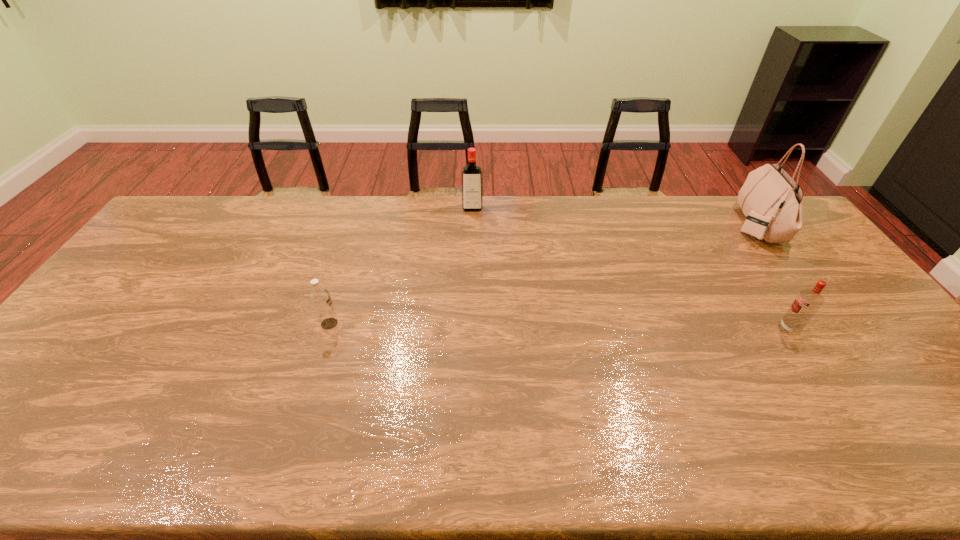
Locate an element on the screen. vacant area between the tallest object and the third object from left to right is located at coordinates (772, 276).

Where is `vacant area that lies between the second object from right to left and the rightmost object`? vacant area that lies between the second object from right to left and the rightmost object is located at coordinates (772, 276).

Where is `object that is the third closest one to the third object from left to right`? The image size is (960, 540). object that is the third closest one to the third object from left to right is located at coordinates (320, 298).

Select which object is the third closest to the handbag. Please provide its 2D coordinates. Your answer should be formatted as a tuple, i.e. [(x, y)], where the tuple contains the x and y coordinates of a point satisfying the conditions above.

[(320, 298)]

Identify which vodka is the second closest to the leftmost vodka. Please provide its 2D coordinates. Your answer should be formatted as a tuple, i.e. [(x, y)], where the tuple contains the x and y coordinates of a point satisfying the conditions above.

[(807, 303)]

Identify which vodka is located as the nearest to the rightmost vodka. Please provide its 2D coordinates. Your answer should be formatted as a tuple, i.e. [(x, y)], where the tuple contains the x and y coordinates of a point satisfying the conditions above.

[(471, 174)]

The width and height of the screenshot is (960, 540). I want to click on free space that satisfies the following two spatial constraints: 1. on the front and back of the farthest vodka; 2. on the front label of the leftmost vodka, so click(470, 323).